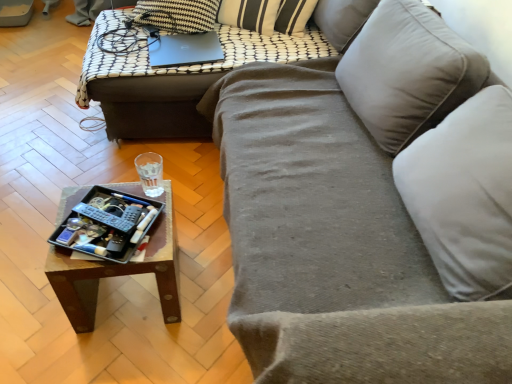
This screenshot has height=384, width=512. What do you see at coordinates (104, 217) in the screenshot?
I see `black plastic remote at lower left` at bounding box center [104, 217].

At what (x,y) coordinates should I click in order to perform the action: click on matte black laptop at upper center. Please return your answer as a coordinate pair (x, y). Looking at the image, I should click on (184, 49).

The height and width of the screenshot is (384, 512). In order to click on black plastic remote at lower left in this screenshot , I will do (x=104, y=217).

How many degrees apart are the facing directions of matte black laptop at upper center and black plastic remote at lower left?

They differ by 129 degrees in their facing directions.

Where is `laptop that is above the black plastic remote at lower left (from a real-world perspective)`? laptop that is above the black plastic remote at lower left (from a real-world perspective) is located at coordinates (x=184, y=49).

Which of these two, matte black laptop at upper center or black plastic remote at lower left, is smaller?

black plastic remote at lower left.

Is metallic tray at lower left smaller than velvet gray couch at center?

Yes.

From a real-world perspective, is metallic tray at lower left physically below velvet gray couch at center?

Yes, from a real-world perspective, metallic tray at lower left is beneath velvet gray couch at center.

Based on their positions, is metallic tray at lower left located to the left or right of velvet gray couch at center?

metallic tray at lower left is positioned on velvet gray couch at center's left side.

In the scene shown: Would you say metallic tray at lower left is outside velvet gray couch at center?

metallic tray at lower left is positioned outside velvet gray couch at center.

Is wooden tray at center shorter than velvet gray couch at center?

Correct, wooden tray at center is not as tall as velvet gray couch at center.

Is wooden tray at center far away from velvet gray couch at center?

No, wooden tray at center is in close proximity to velvet gray couch at center.

From a real-world perspective, is wooden tray at center over velvet gray couch at center?

Actually, wooden tray at center is physically below velvet gray couch at center in the real world.

Does point (148, 260) lie in front of point (123, 231)?

That is True.

Which is more to the right, wooden tray at center or black plastic remote at lower left?

Positioned to the right is wooden tray at center.

Looking at this image, in terms of height, does wooden tray at center look taller or shorter compared to black plastic remote at lower left?

In the image, wooden tray at center appears to be taller than black plastic remote at lower left.

The image size is (512, 384). I want to click on remote on the left side of wooden tray at center, so click(104, 217).

Considering the positions of objects wooden tray at center and velvet gray couch at center in the image provided, who is in front, wooden tray at center or velvet gray couch at center?

velvet gray couch at center is closer to the camera.

Considering the relative sizes of wooden tray at center and velvet gray couch at center in the image provided, is wooden tray at center shorter than velvet gray couch at center?

Indeed, wooden tray at center has a lesser height compared to velvet gray couch at center.

Would you say wooden tray at center is inside or outside velvet gray couch at center?

wooden tray at center exists outside the volume of velvet gray couch at center.

Can you confirm if wooden tray at center is positioned to the right of velvet gray couch at center?

Incorrect, wooden tray at center is not on the right side of velvet gray couch at center.

Which object is further away from the camera, black plastic remote at lower left or wooden tray at center?

wooden tray at center is further away from the camera.

From a real-world perspective, is black plastic remote at lower left positioned under wooden tray at center based on gravity?

No, from a real-world perspective, black plastic remote at lower left is not below wooden tray at center.

Can you confirm if black plastic remote at lower left is bigger than wooden tray at center?

No.

Is black plastic remote at lower left located outside matte black laptop at upper center?

Yes, black plastic remote at lower left is outside of matte black laptop at upper center.

How different are the orientations of black plastic remote at lower left and matte black laptop at upper center in degrees?

129 degrees separate the facing orientations of black plastic remote at lower left and matte black laptop at upper center.

Would you consider black plastic remote at lower left to be distant from matte black laptop at upper center?

Indeed, black plastic remote at lower left is not near matte black laptop at upper center.

From a real-world perspective, which object stands above the other?

In real-world perspective, matte black laptop at upper center is above.

The height and width of the screenshot is (384, 512). I want to click on remote below the matte black laptop at upper center (from a real-world perspective), so click(104, 217).

Locate an element on the screen. tray below the velvet gray couch at center (from the image's perspective) is located at coordinates (106, 224).

Considering their positions, is wooden tray at center positioned closer to matte black laptop at upper center than black plastic remote at lower left?

wooden tray at center is positioned closer to the anchor matte black laptop at upper center.

From the image, which object appears to be farther from velvet gray couch at center, black plastic remote at lower left or wooden tray at center?

black plastic remote at lower left is further to velvet gray couch at center.

Based on the photo, estimate the real-world distances between objects in this image. Which object is further from metallic tray at lower left, wooden tray at center or matte black laptop at upper center?

matte black laptop at upper center is positioned further to the anchor metallic tray at lower left.

Which object lies nearer to the anchor point black plastic remote at lower left, metallic tray at lower left or wooden tray at center?

Among the two, metallic tray at lower left is located nearer to black plastic remote at lower left.

Considering their positions, is black plastic remote at lower left positioned further to wooden tray at center than metallic tray at lower left?

The object further to wooden tray at center is black plastic remote at lower left.

Considering their positions, is wooden tray at center positioned closer to black plastic remote at lower left than velvet gray couch at center?

velvet gray couch at center.

Based on their spatial positions, is wooden tray at center or wooden tray at center further from black plastic remote at lower left?

wooden tray at center.

Based on their spatial positions, is wooden tray at center or velvet gray couch at center further from metallic tray at lower left?

The object further to metallic tray at lower left is velvet gray couch at center.

This screenshot has height=384, width=512. I want to click on tray between wooden tray at center and velvet gray couch at center from left to right, so pos(106,224).

Where is `tray that lies between matte black laptop at upper center and wooden tray at center from top to bottom`? tray that lies between matte black laptop at upper center and wooden tray at center from top to bottom is located at coordinates (x=106, y=224).

Identify the location of tray situated between black plastic remote at lower left and velvet gray couch at center from left to right. The image size is (512, 384). (106, 224).

The height and width of the screenshot is (384, 512). Find the location of `coffee table between black plastic remote at lower left and velvet gray couch at center from left to right`. coffee table between black plastic remote at lower left and velvet gray couch at center from left to right is located at coordinates (118, 273).